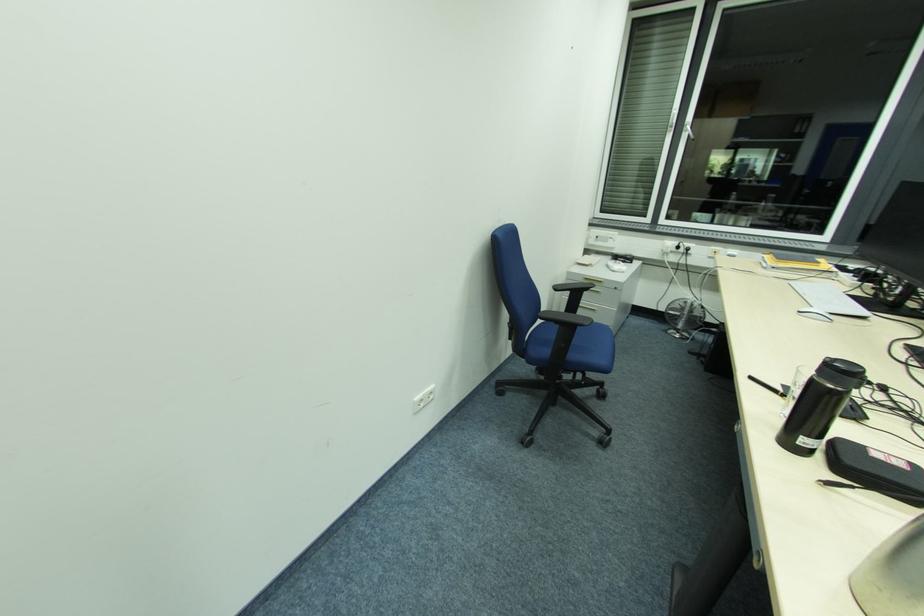
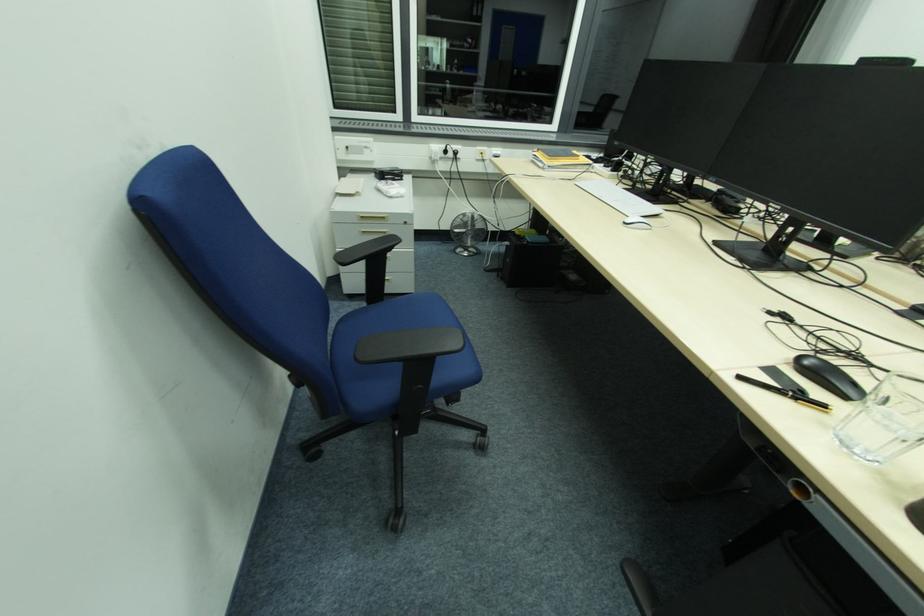
First-person continuous shooting, in which direction is the camera rotating?

The rotation direction of the camera is right-down.